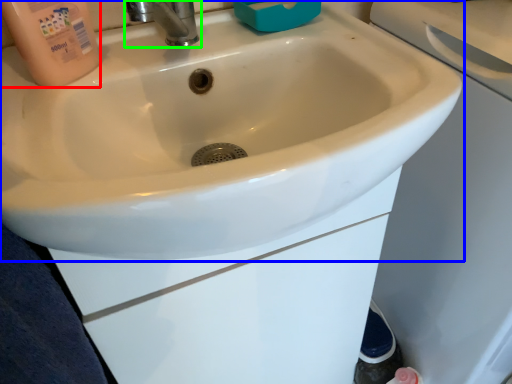
Question: Considering the real-world distances, which object is farthest from cleaning product (highlighted by a red box)? sink (highlighted by a blue box) or tap (highlighted by a green box)?

Choices:
 (A) sink
 (B) tap

Answer: (A)